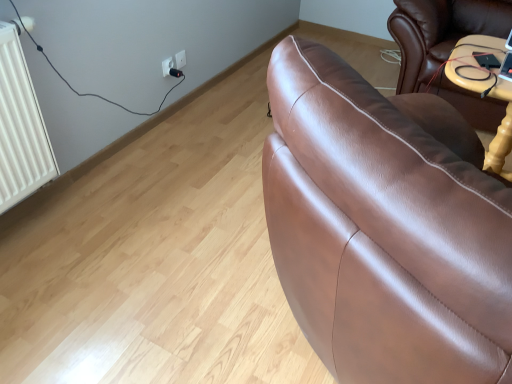
Question: From a real-world perspective, is white plastic socket at upper left, acting as the 1th electric outlet starting from the right, on white plastic socket at upper center, which is the 1th electric outlet from left to right?

Choices:
 (A) yes
 (B) no

Answer: (A)

Question: Considering the relative positions of white plastic socket at upper left, acting as the 1th electric outlet starting from the right, and white plastic socket at upper center, which is the 1th electric outlet from left to right, in the image provided, is white plastic socket at upper left, acting as the 1th electric outlet starting from the right, to the left of white plastic socket at upper center, which is the 1th electric outlet from left to right, from the viewer's perspective?

Choices:
 (A) no
 (B) yes

Answer: (A)

Question: Is white plastic socket at upper left, the second electric outlet positioned from the left, shorter than white plastic socket at upper center, the second electric outlet when ordered from right to left?

Choices:
 (A) yes
 (B) no

Answer: (A)

Question: From a real-world perspective, is white plastic socket at upper left, acting as the 1th electric outlet starting from the right, below white plastic socket at upper center, which is the 1th electric outlet from left to right?

Choices:
 (A) no
 (B) yes

Answer: (A)

Question: From the image's perspective, does white plastic socket at upper left, acting as the 1th electric outlet starting from the right, appear lower than white plastic socket at upper center, which is the 1th electric outlet from left to right?

Choices:
 (A) no
 (B) yes

Answer: (A)

Question: From the image's perspective, relative to white plastic socket at upper center, which is the 1th electric outlet from left to right, is black plastic plug at upper center above or below?

Choices:
 (A) below
 (B) above

Answer: (A)

Question: In terms of size, does black plastic plug at upper center appear bigger or smaller than white plastic socket at upper center, the second electric outlet when ordered from right to left?

Choices:
 (A) small
 (B) big

Answer: (A)

Question: From a real-world perspective, is black plastic plug at upper center above or below white plastic socket at upper center, the second electric outlet when ordered from right to left?

Choices:
 (A) below
 (B) above

Answer: (A)

Question: Would you say black plastic plug at upper center is inside or outside white plastic socket at upper center, the second electric outlet when ordered from right to left?

Choices:
 (A) inside
 (B) outside

Answer: (A)

Question: From the image's perspective, is white plastic socket at upper left, the second electric outlet positioned from the left, positioned above or below white plastic socket at upper center, which is the 1th electric outlet from left to right?

Choices:
 (A) below
 (B) above

Answer: (B)

Question: Considering the relative positions of white plastic socket at upper left, the second electric outlet positioned from the left, and white plastic socket at upper center, which is the 1th electric outlet from left to right, in the image provided, is white plastic socket at upper left, the second electric outlet positioned from the left, to the left or to the right of white plastic socket at upper center, which is the 1th electric outlet from left to right,?

Choices:
 (A) right
 (B) left

Answer: (A)

Question: Is white plastic socket at upper left, acting as the 1th electric outlet starting from the right, situated inside white plastic socket at upper center, the second electric outlet when ordered from right to left, or outside?

Choices:
 (A) inside
 (B) outside

Answer: (B)

Question: From a real-world perspective, is white plastic socket at upper left, acting as the 1th electric outlet starting from the right, physically located above or below white plastic socket at upper center, which is the 1th electric outlet from left to right?

Choices:
 (A) above
 (B) below

Answer: (A)

Question: From the image's perspective, is white plastic socket at upper center, which is the 1th electric outlet from left to right, located above or below white plastic socket at upper left, acting as the 1th electric outlet starting from the right?

Choices:
 (A) above
 (B) below

Answer: (B)

Question: Is white plastic socket at upper center, the second electric outlet when ordered from right to left, bigger or smaller than white plastic socket at upper left, acting as the 1th electric outlet starting from the right?

Choices:
 (A) big
 (B) small

Answer: (A)